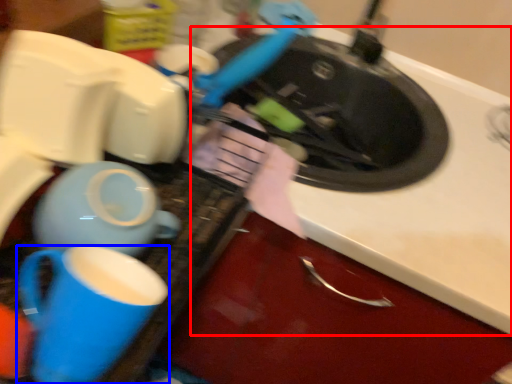
Question: Among these objects, which one is farthest to the camera, counter top (highlighted by a red box) or coffee cup (highlighted by a blue box)?

Choices:
 (A) counter top
 (B) coffee cup

Answer: (A)